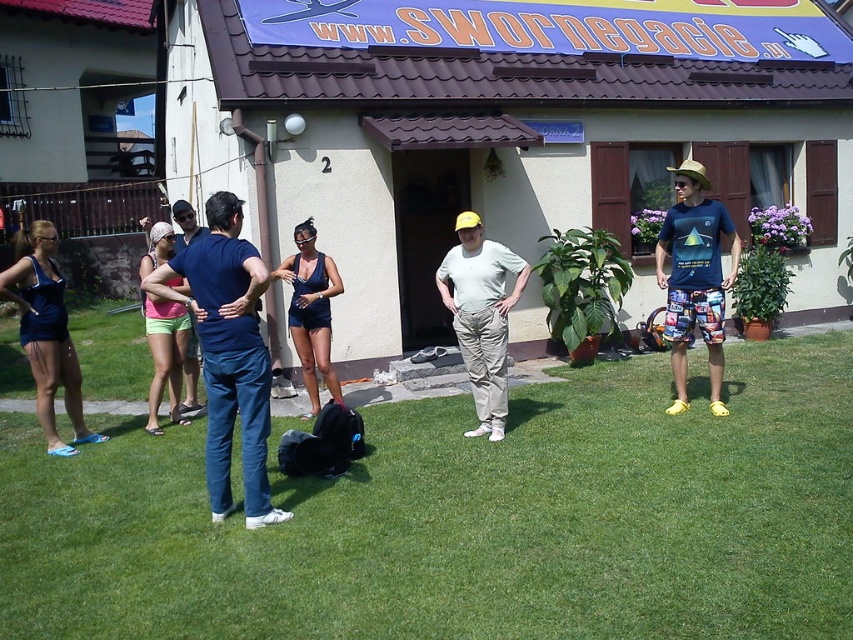
You are at a beach party and see two items on the sand. There is a matte blue swimsuit at left and a pink fabric shorts at center. Which item has a smaller width?

The matte blue swimsuit at left is thinner than the pink fabric shorts at center, so the matte blue swimsuit at left has a smaller width.

You are organizing a beach day and need to pack items from the image. Which item takes up more space in your bag when packing the matte blue swimsuit at left and the pink fabric shorts at center?

The pink fabric shorts at center takes up more space than the matte blue swimsuit at left because the matte blue swimsuit at left occupies less space than pink fabric shorts at center.

You are a photographer taking pictures of the group at the event. You notice the matte blue swimsuit at left and the pink fabric shorts at center. Which clothing item is positioned higher in the image?

The matte blue swimsuit at left is above the pink fabric shorts at center, so the matte blue swimsuit at left is positioned higher in the image.